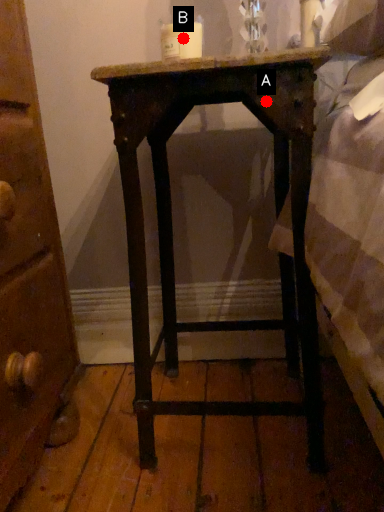
Question: Two points are circled on the image, labeled by A and B beside each circle. Which point appears closest to the camera in this image?

Choices:
 (A) A is closer
 (B) B is closer

Answer: (A)